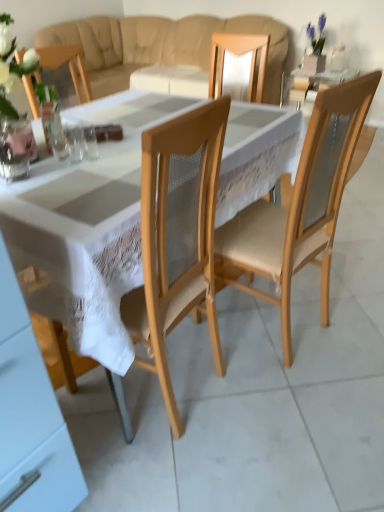
Locate an element on the screen. vacant space behind clear glass at center, the 1th tableware from the left is located at coordinates (74, 142).